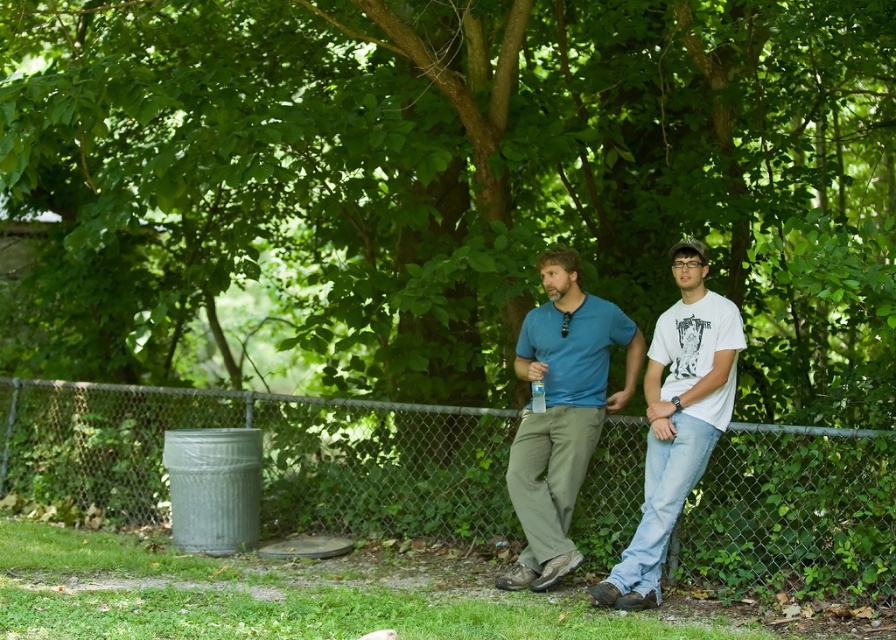
Question: Does matte blue shirt at center come behind white cotton t-shirt at right?

Choices:
 (A) yes
 (B) no

Answer: (A)

Question: Among these points, which one is nearest to the camera?

Choices:
 (A) (322, 420)
 (B) (666, 308)

Answer: (B)

Question: Is matte blue shirt at center in front of white cotton t-shirt at right?

Choices:
 (A) yes
 (B) no

Answer: (B)

Question: Among these points, which one is farthest from the camera?

Choices:
 (A) (659, 456)
 (B) (872, 436)

Answer: (A)

Question: Considering the relative positions of metal chain-link fence at center and white cotton t-shirt at right in the image provided, where is metal chain-link fence at center located with respect to white cotton t-shirt at right?

Choices:
 (A) left
 (B) right

Answer: (B)

Question: Which object is the closest to the white cotton t-shirt at right?

Choices:
 (A) matte blue shirt at center
 (B) metal chain-link fence at center

Answer: (A)